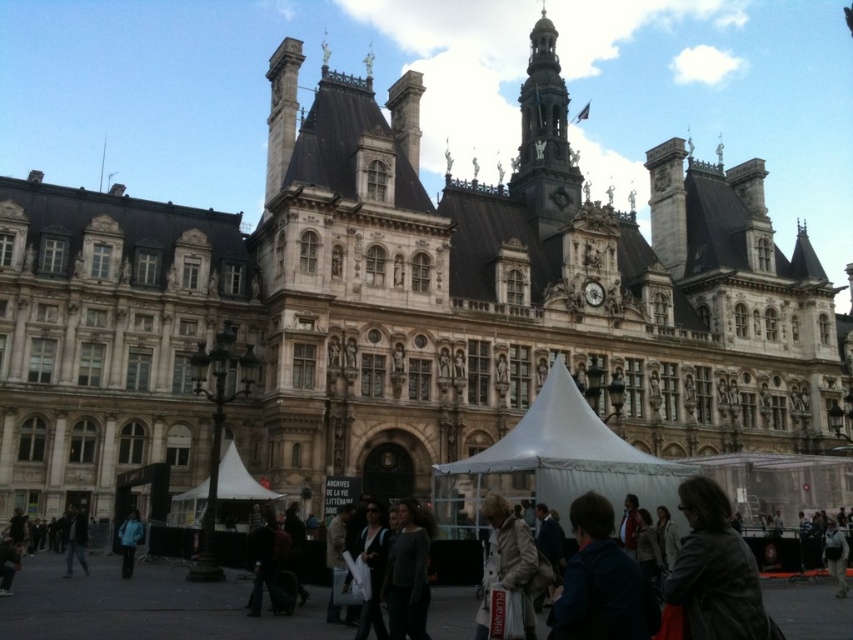
Is leather jacket at center to the left of light beige coat at center from the viewer's perspective?

In fact, leather jacket at center is to the right of light beige coat at center.

In the scene shown: Can you confirm if leather jacket at center is positioned to the right of light beige coat at center?

Yes, leather jacket at center is to the right of light beige coat at center.

What do you see at coordinates (715, 572) in the screenshot? The width and height of the screenshot is (853, 640). I see `leather jacket at center` at bounding box center [715, 572].

The image size is (853, 640). Identify the location of leather jacket at center. (715, 572).

Can you confirm if light beige coat at center is positioned to the right of dark gray jacket at lower left?

Correct, you'll find light beige coat at center to the right of dark gray jacket at lower left.

Which is more to the left, light beige coat at center or dark gray jacket at lower left?

dark gray jacket at lower left is more to the left.

Where is `light beige coat at center`? The image size is (853, 640). light beige coat at center is located at coordinates (508, 563).

Between point (425, 579) and point (512, 509), which one is positioned behind?

Positioned behind is point (512, 509).

Find the location of a particular element. knitted gray sweater at center is located at coordinates (408, 573).